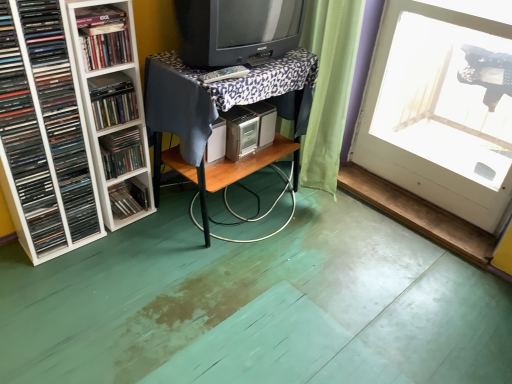
The height and width of the screenshot is (384, 512). In order to click on free space in front of white plastic shelf at left in this screenshot , I will do `click(121, 247)`.